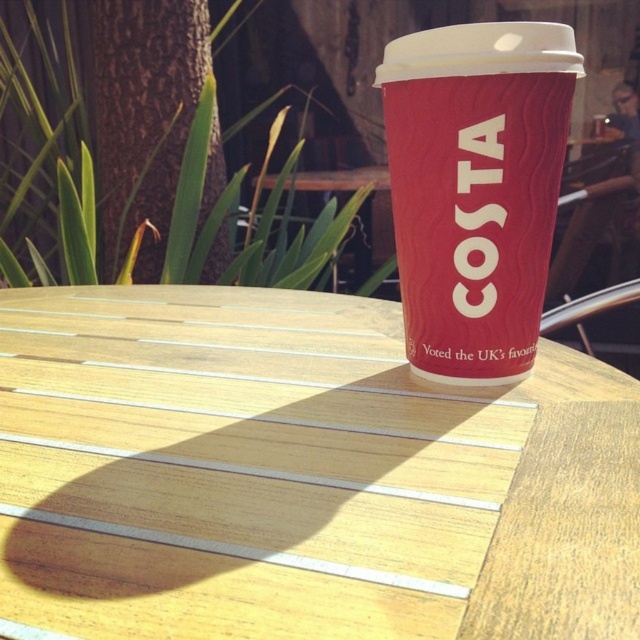
You are at a park picnic table and want to place your matte red cup at center on the wooden table at center. Considering the table dimensions, will the cup fit entirely on the table without hanging over the edges?

The wooden table at center is wider than the matte red cup at center, so the cup will fit entirely on the table without hanging over the edges.

You are a barista trying to place a new coffee cup on the wooden table at center. The cup you have is 12 centimeters in diameter. Can the matte red cup at center currently on the table fit another cup of this size next to it without overlapping?

The wooden table at center is 15.50 centimeters from the matte red cup at center. Since the distance between them is 15.50 cm, which is greater than the 12 cm diameter of the new cup, there is enough space to place another cup next to the matte red cup at center without overlapping.

You are standing at the point marked by the coordinates (300,476) in the image. What object are you directly standing on?

The wooden table at center is represented by point (300,476), so you are directly standing on the wooden table at center.